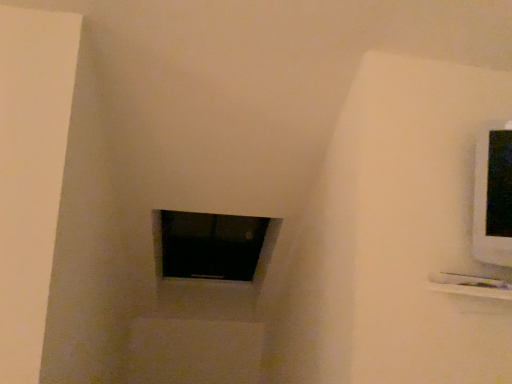
Measure the distance between black matte window at center and camera.

black matte window at center is 2.42 meters from camera.

What do you see at coordinates (209, 246) in the screenshot? I see `black matte window at center` at bounding box center [209, 246].

Measure the distance between point (203,221) and camera.

Point (203,221) and camera are 2.70 meters apart from each other.

Where is `black matte window at center`? This screenshot has height=384, width=512. black matte window at center is located at coordinates (209, 246).

The width and height of the screenshot is (512, 384). What are the coordinates of `black matte window at center` in the screenshot? It's located at (209, 246).